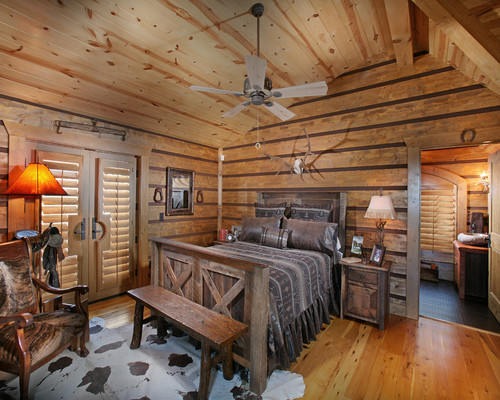
In order to click on door in this screenshot , I will do `click(111, 215)`.